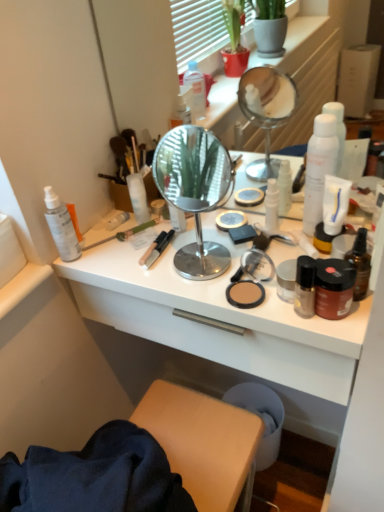
In order to click on free area in between translucent plastic spray bottle at left, which is the eighth toiletry in right-to-left order, and satin black nail polish at right, which appears as the sixth toiletry when viewed from the left in this screenshot , I will do [x=161, y=281].